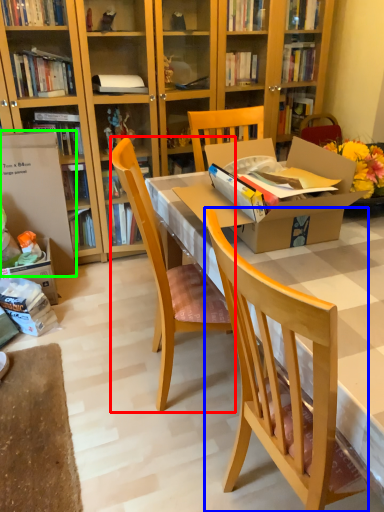
Question: Estimate the real-world distances between objects in this image. Which object is farther from chair (highlighted by a red box), chair (highlighted by a blue box) or box (highlighted by a green box)?

Choices:
 (A) chair
 (B) box

Answer: (B)